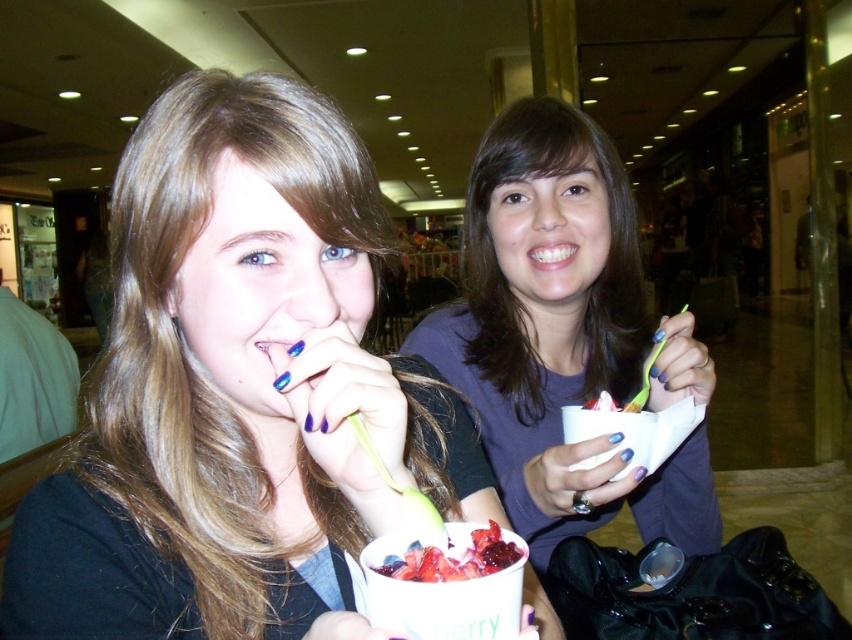
You are a photographer trying to capture a closeup shot of the smooth strawberry dessert at center without including the matte purple shirt at center in the frame. Based on their positions, is this possible?

The matte purple shirt at center is positioned on the right side of the smooth strawberry dessert at center, so if you position your camera to the left side of the dessert, you can capture the smooth strawberry dessert at center without including the matte purple shirt at center in the frame.

You are a photographer trying to capture a closeup of the blue nail polish at mouth left while also including the smooth strawberry dessert at center in the frame. Based on their positions, will you need to adjust your camera to focus on both objects simultaneously?

The smooth strawberry dessert at center is closer to the viewer than the blue nail polish at mouth left. Since they are at different distances, adjusting the camera focus might be necessary to ensure both are in clear view.

You are designing a new line of clothing and want to ensure that the shirts can be worn comfortably by people of different body types. Given that the matte black shirt at center is wider than the matte purple shirt at center, which shirt would you recommend for someone who prefers a looser fit?

The matte black shirt at center is wider than the matte purple shirt at center, so it would be more suitable for someone who prefers a looser fit.